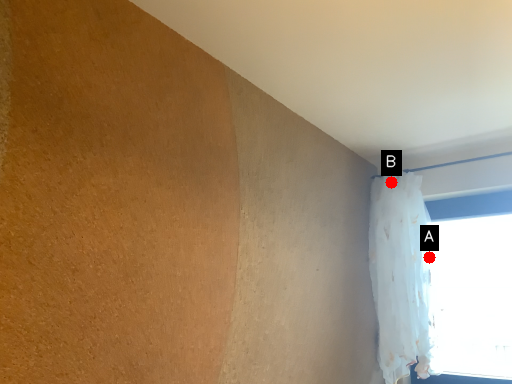
Question: Two points are circled on the image, labeled by A and B beside each circle. Among these points, which one is farthest from the camera?

Choices:
 (A) A is further
 (B) B is further

Answer: (B)